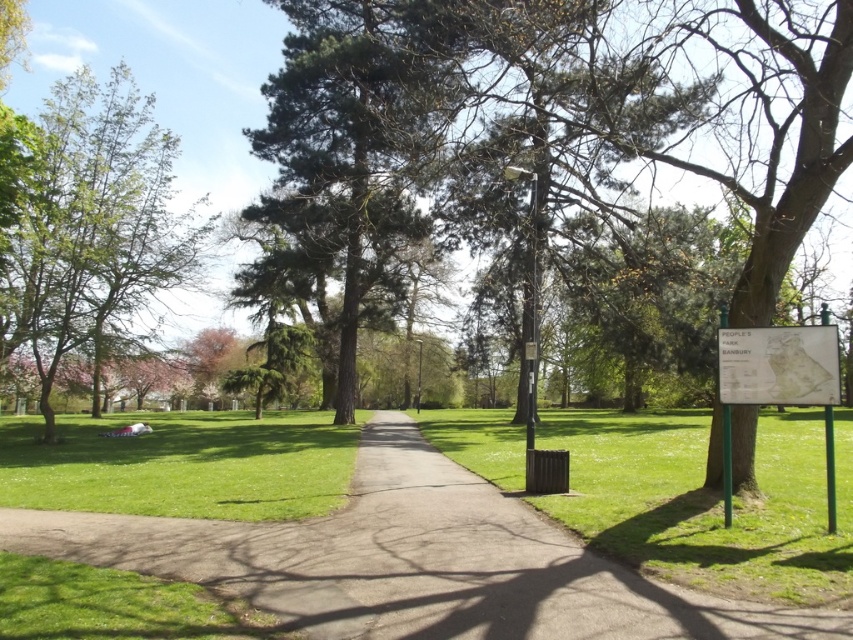
Question: Does green grass at center appear under green grassy at lower left?

Choices:
 (A) no
 (B) yes

Answer: (A)

Question: Can you confirm if green grass at center is bigger than white paper map at right?

Choices:
 (A) yes
 (B) no

Answer: (A)

Question: Which object appears closest to the camera in this image?

Choices:
 (A) green grassy at lower left
 (B) white paper map at right
 (C) green grass at center

Answer: (C)

Question: Can you confirm if green grass at center is positioned below white paper map at right?

Choices:
 (A) yes
 (B) no

Answer: (A)

Question: Which point is closer to the camera taking this photo?

Choices:
 (A) (219, 426)
 (B) (151, 148)
 (C) (828, 333)
 (D) (705, 620)

Answer: (D)

Question: Which point is closer to the camera?

Choices:
 (A) pyautogui.click(x=436, y=524)
 (B) pyautogui.click(x=155, y=438)
 (C) pyautogui.click(x=93, y=387)

Answer: (A)